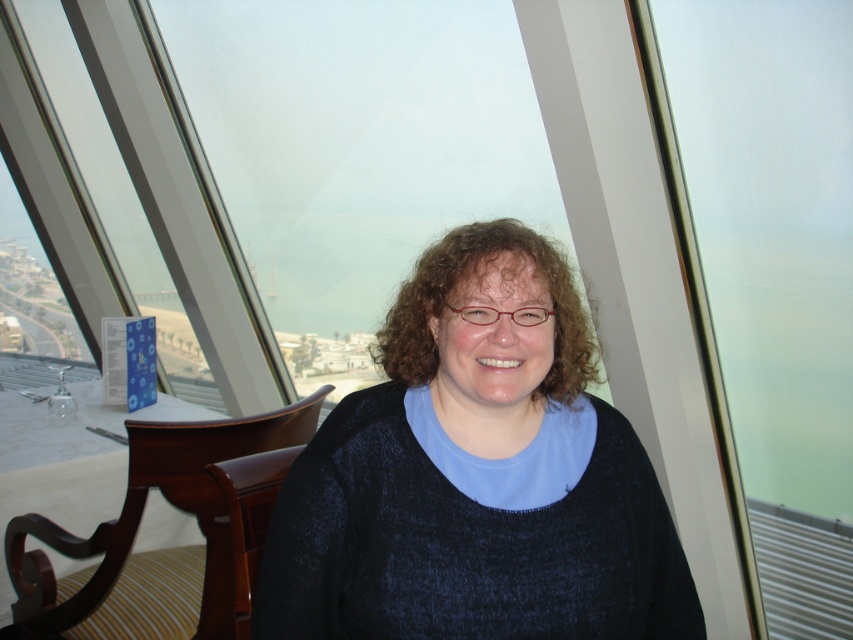
You are standing in the room where the person is sitting. You want to look out the frosted glass window at center but you need to move the mahogany wood chair at lower left first. Can you tell me which object is taller so you know which one to move first?

The frosted glass window at center is taller than the mahogany wood chair at lower left, so you should move the mahogany wood chair at lower left first to see out the frosted glass window at center.

You are a photographer holding a camera. You want to take a photo of the black knitted sweater at center from a distance that allows you to capture the entire sweater in the frame without moving the camera. If your camera has a minimum focusing distance of 1 meter, will you be able to take the photo clearly?

The black knitted sweater at center and camera are 1.03 meters apart from each other. Since the minimum focusing distance is 1 meter, the photographer can take a clear photo as the distance is slightly more than the required minimum.